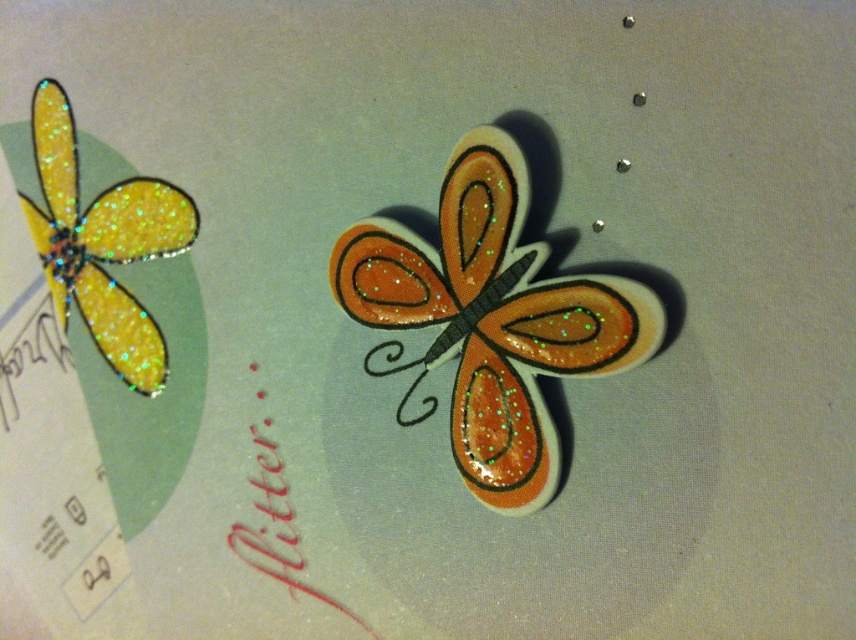
Can you confirm if glittery orange fabric butterfly at center is positioned to the left of glittery yellow butterfly at upper left?

Incorrect, glittery orange fabric butterfly at center is not on the left side of glittery yellow butterfly at upper left.

Who is taller, glittery orange fabric butterfly at center or glittery yellow butterfly at upper left?

glittery orange fabric butterfly at center is taller.

Between point (479, 145) and point (49, 125), which one is positioned behind?

The point (49, 125) is behind.

In order to click on glittery orange fabric butterfly at center in this screenshot , I will do `click(491, 320)`.